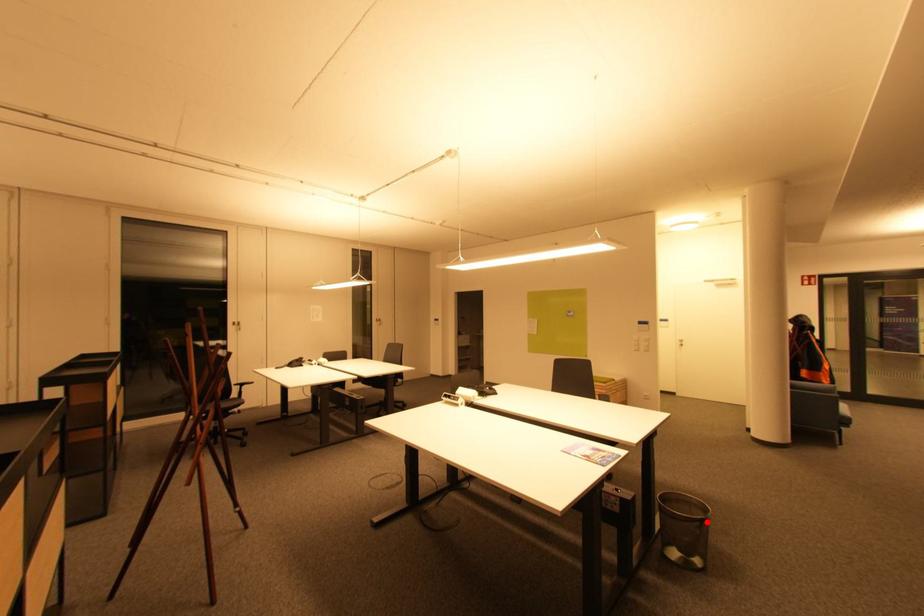
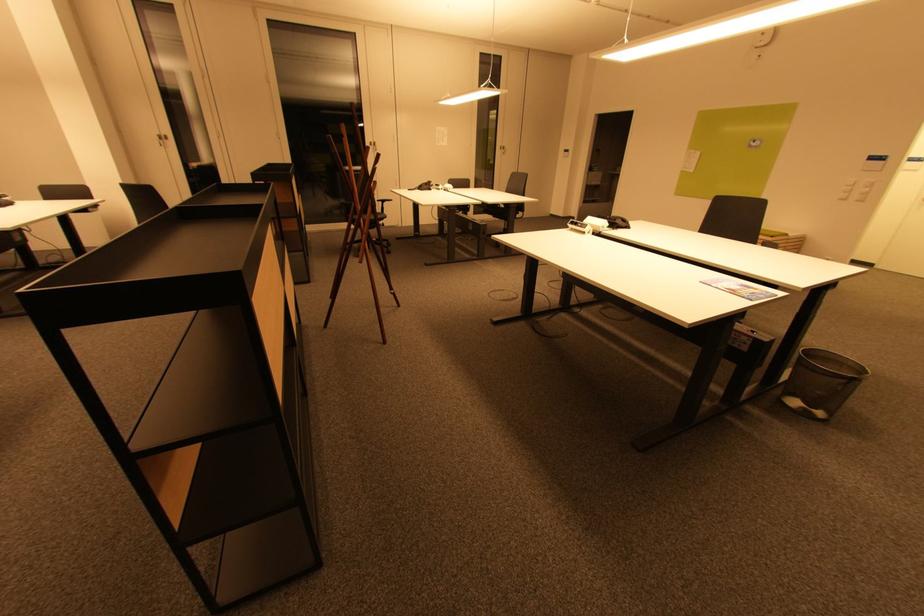
Question: A red point is marked in image1. In image2, is the corresponding 3D point closer to the camera or farther? Reply with the corresponding letter.

Choices:
 (A) The corresponding 3D point is closer.
 (B) The corresponding 3D point is farther.

Answer: (B)